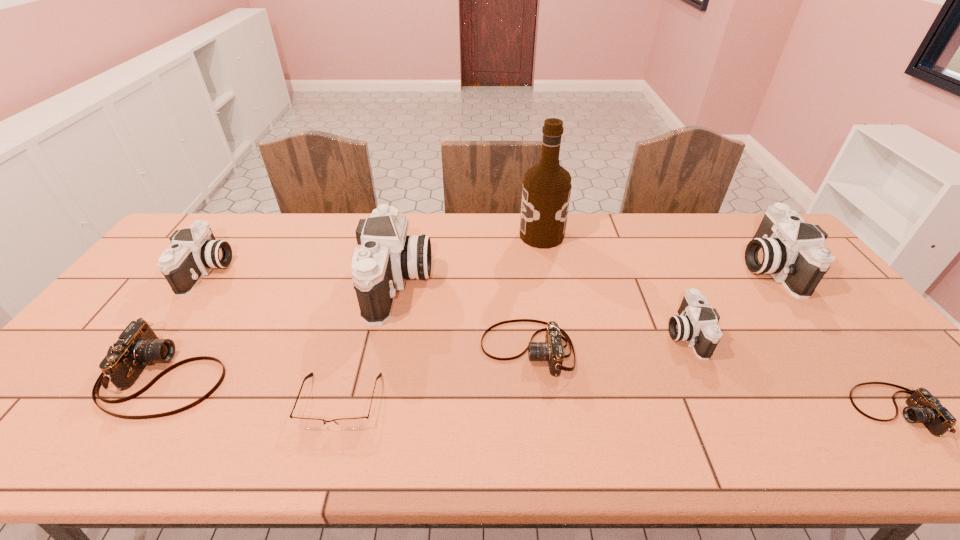
Locate an element on the screen. The height and width of the screenshot is (540, 960). the third shortest camera is located at coordinates (138, 346).

Find the location of `the leftmost brown camera`. the leftmost brown camera is located at coordinates (138, 346).

This screenshot has height=540, width=960. Identify the location of the second brown camera from right to left. (552, 350).

Locate an element on the screen. the fourth camera from left to right is located at coordinates (552, 350).

The height and width of the screenshot is (540, 960). Find the location of `black spectacles`. black spectacles is located at coordinates (311, 423).

Find the location of a particular element. The image size is (960, 540). spectacles is located at coordinates (311, 423).

You are a GUI agent. You are given a task and a screenshot of the screen. Output one action in this format:
    pyautogui.click(x=<x>, y=<y>)
    Task: Click on the blank space located 0.340m on the label of the brown alcohol
    The height and width of the screenshot is (540, 960).
    Given the screenshot: What is the action you would take?
    pyautogui.click(x=421, y=235)

You are a GUI agent. You are given a task and a screenshot of the screen. Output one action in this format:
    pyautogui.click(x=<x>, y=<y>)
    Task: Click on the vacant space located 0.290m on the label of the brown alcohol
    
    Given the screenshot: What is the action you would take?
    pyautogui.click(x=436, y=235)

Find the location of `free region located 0.190m on the label of the brown alcohol`. free region located 0.190m on the label of the brown alcohol is located at coordinates (465, 235).

Identify the location of free region located on the back of the second tallest object. (409, 232).